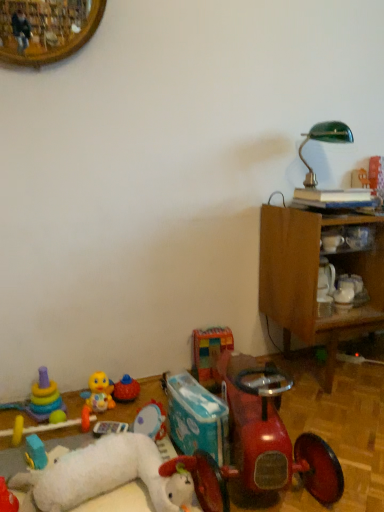
This screenshot has height=512, width=384. In order to click on free space to the right of plush yellow duck at lower left, arranged as the fifth toy when viewed from the left in this screenshot , I will do 132,409.